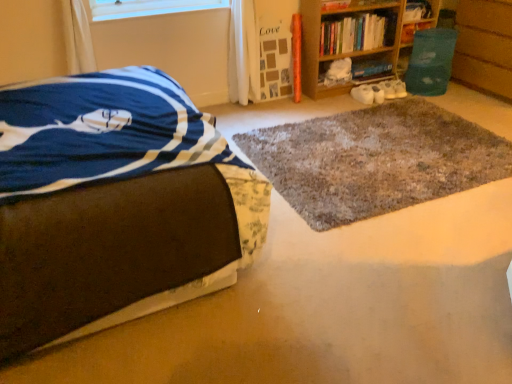
Image resolution: width=512 pixels, height=384 pixels. What are the coordinates of `vacant space in front of shaggy gray rug at center` in the screenshot? It's located at [x=375, y=271].